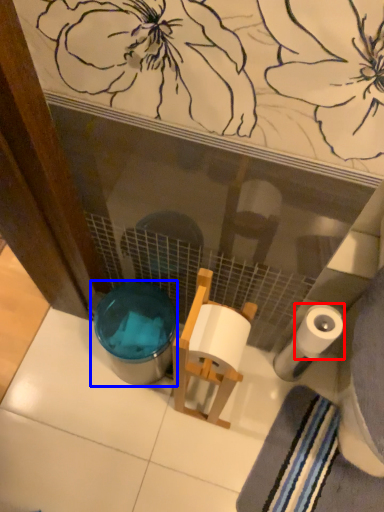
Question: Which object appears farthest to the camera in this image, toilet paper (highlighted by a red box) or potty (highlighted by a blue box)?

Choices:
 (A) toilet paper
 (B) potty

Answer: (B)